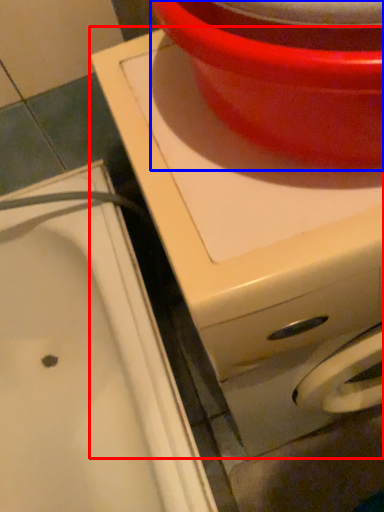
Question: Which object appears closest to the camera in this image, appliance (highlighted by a red box) or basin (highlighted by a blue box)?

Choices:
 (A) appliance
 (B) basin

Answer: (B)